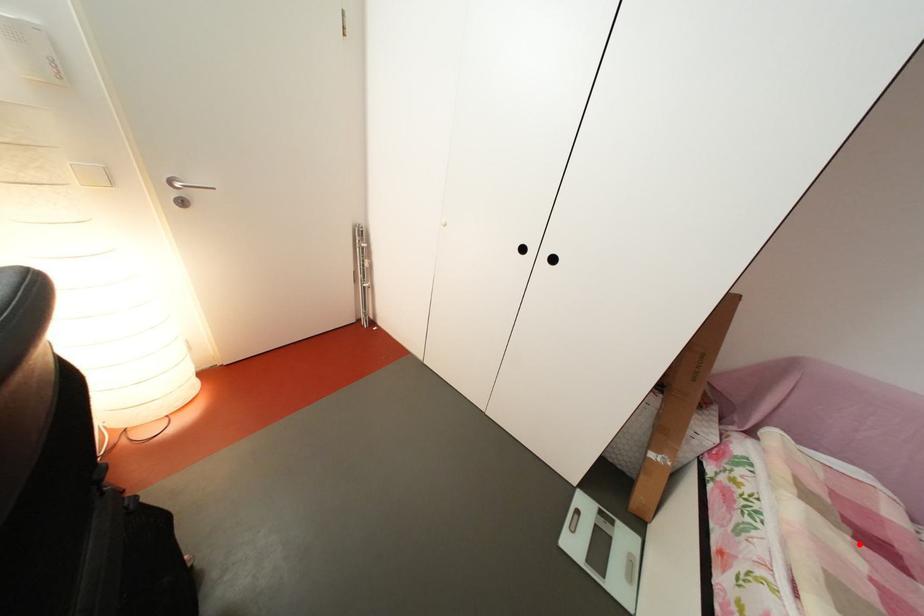
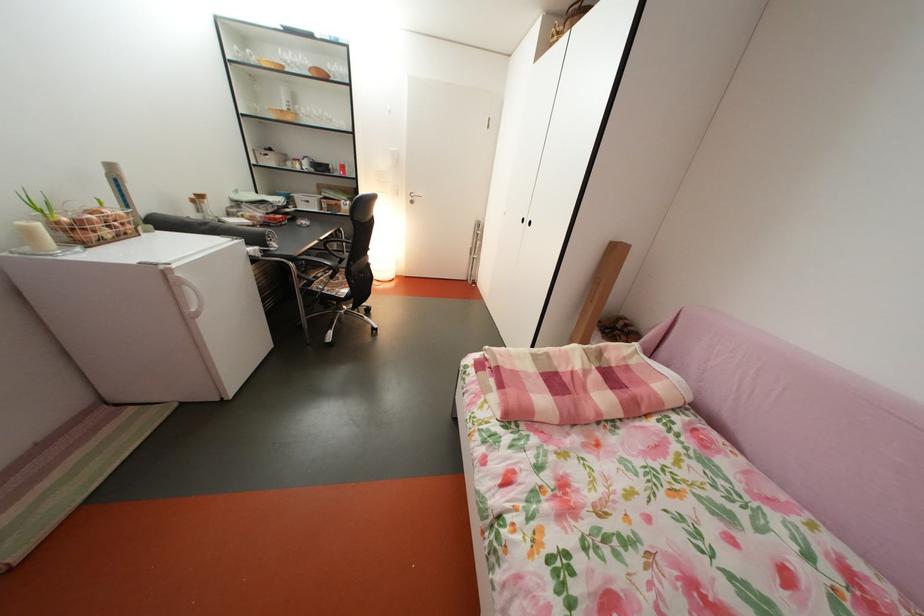
The point at the highlighted location is marked in the first image. Where is the corresponding point in the second image?

(604, 374)